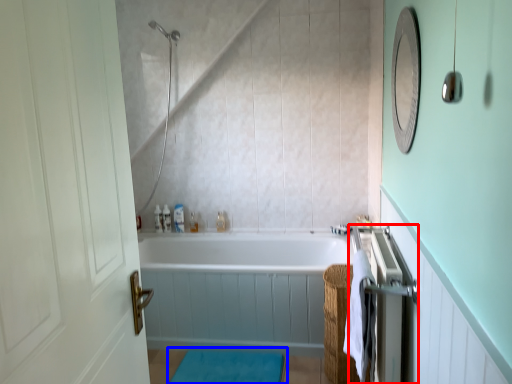
Question: Which object appears farthest to the camera in this image, closet (highlighted by a red box) or bath mat (highlighted by a blue box)?

Choices:
 (A) closet
 (B) bath mat

Answer: (B)